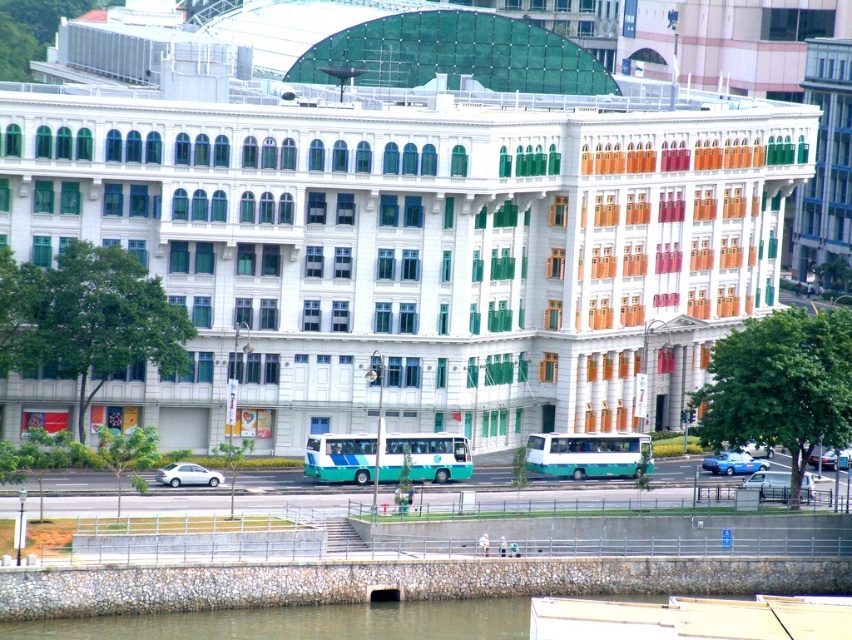
Question: Which point appears closest to the camera in this image?

Choices:
 (A) (816, 445)
 (B) (162, 472)

Answer: (A)

Question: Can you confirm if white matte van at lower right is bigger than blue metallic car at lower right?

Choices:
 (A) yes
 (B) no

Answer: (A)

Question: Does teal glossy bus at center have a lesser width compared to teal/green metallic bus at center?

Choices:
 (A) no
 (B) yes

Answer: (A)

Question: Which object is positioned farthest from the blue metallic car at lower right?

Choices:
 (A) metallic silver car at center
 (B) teal/green metallic bus at center
 (C) white matte van at lower right
 (D) white matte sedan at lower left

Answer: (D)

Question: Which object appears closest to the camera in this image?

Choices:
 (A) metallic silver car at center
 (B) teal glossy bus at center

Answer: (A)

Question: Is white matte van at lower right wider than blue metallic car at lower right?

Choices:
 (A) yes
 (B) no

Answer: (A)